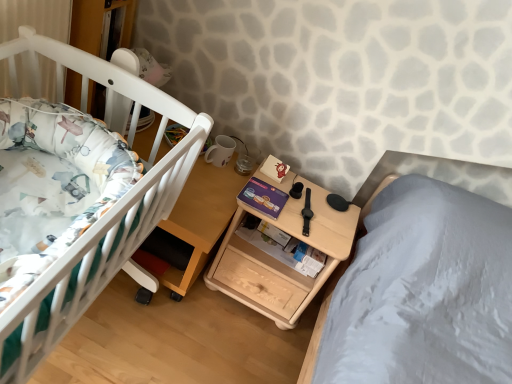
Question: Is wooden bookshelf at upper left in front of or behind natural wood nightstand at center in the image?

Choices:
 (A) behind
 (B) front

Answer: (A)

Question: Looking at their shapes, would you say wooden bookshelf at upper left is wider or thinner than natural wood nightstand at center?

Choices:
 (A) thin
 (B) wide

Answer: (A)

Question: Based on their relative distances, which object is nearer to the white matte crib at left?

Choices:
 (A) wooden table at left
 (B) natural wood nightstand at center
 (C) wooden bookshelf at upper left

Answer: (A)

Question: Estimate the real-world distances between objects in this image. Which object is farther from the wooden bookshelf at upper left?

Choices:
 (A) wooden table at left
 (B) natural wood nightstand at center
 (C) white matte crib at left

Answer: (B)